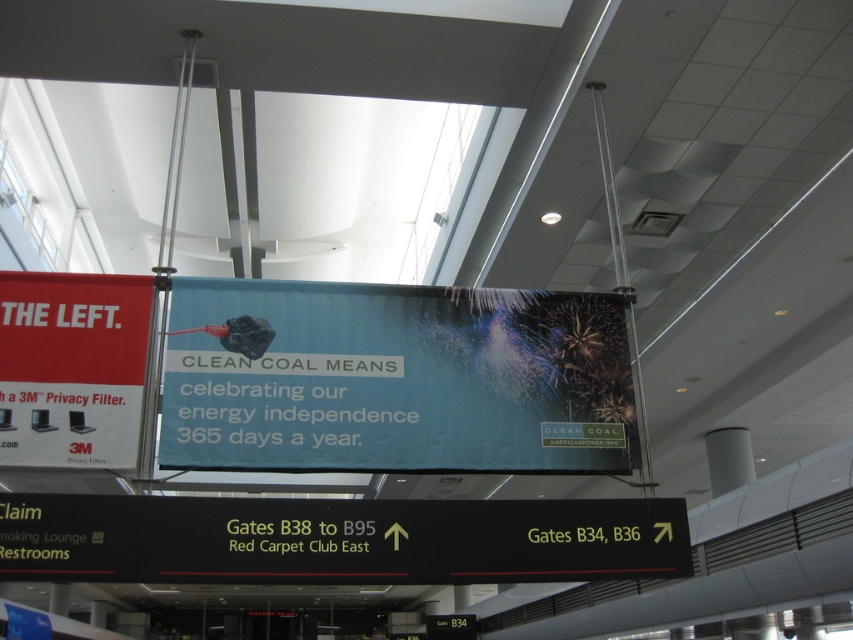
Based on the photo, is black matte sign at lower center positioned before matte red banner at left?

Yes, it is.

Between black matte sign at lower center and matte red banner at left, which one has more height?

matte red banner at left is taller.

Looking at this image, measure the distance between point (120, 568) and camera.

4.89 meters

Locate an element on the screen. black matte sign at lower center is located at coordinates (338, 540).

Can you confirm if blue fabric billboard at center is wider than black matte sign at lower center?

No.

Identify the location of blue fabric billboard at center. (395, 380).

This screenshot has height=640, width=853. I want to click on blue fabric billboard at center, so click(395, 380).

Which is below, blue fabric billboard at center or matte red banner at left?

blue fabric billboard at center is below.

Which of these two, blue fabric billboard at center or matte red banner at left, stands taller?

blue fabric billboard at center is taller.

What do you see at coordinates (395, 380) in the screenshot? Image resolution: width=853 pixels, height=640 pixels. I see `blue fabric billboard at center` at bounding box center [395, 380].

At what (x,y) coordinates should I click in order to perform the action: click on blue fabric billboard at center. Please return your answer as a coordinate pair (x, y). The height and width of the screenshot is (640, 853). Looking at the image, I should click on (395, 380).